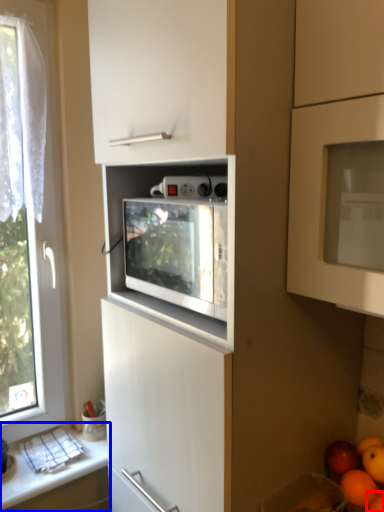
Question: Among these objects, which one is farthest to the camera, orange (highlighted by a red box) or countertop (highlighted by a blue box)?

Choices:
 (A) orange
 (B) countertop

Answer: (B)